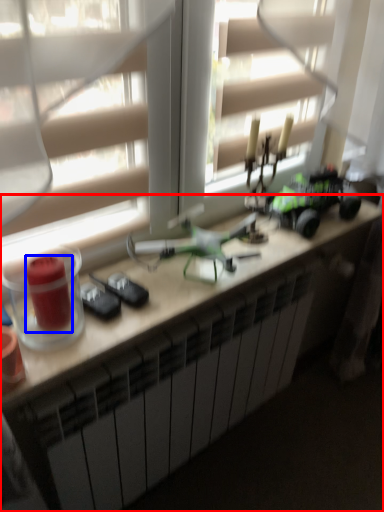
Question: Which object appears closest to the camera in this image, desk (highlighted by a red box) or candle holder (highlighted by a blue box)?

Choices:
 (A) desk
 (B) candle holder

Answer: (B)